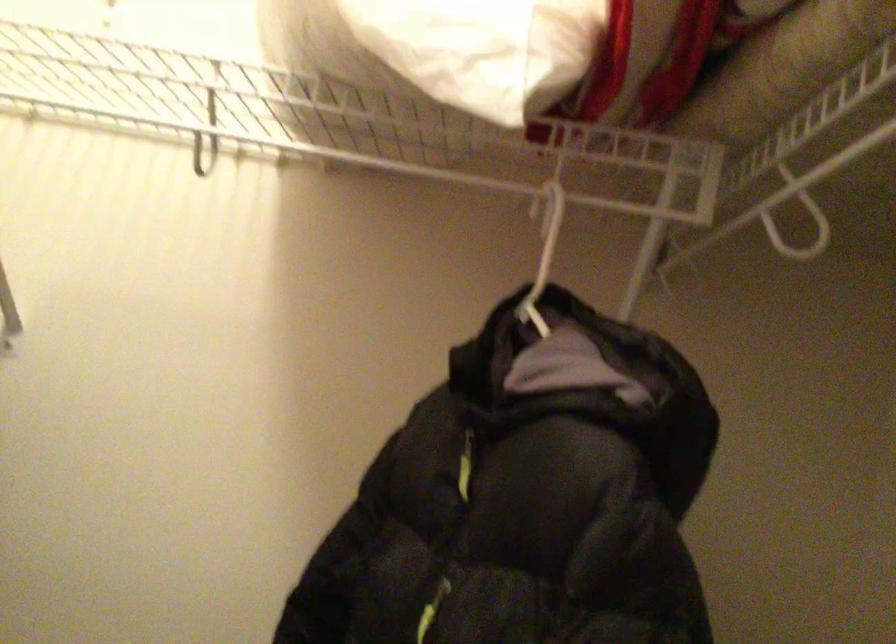
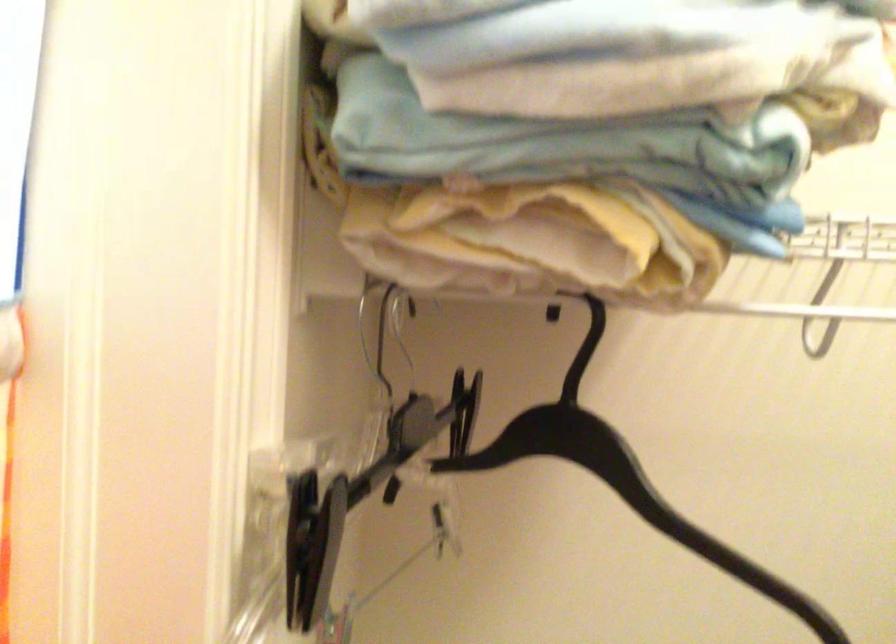
Question: What movement of the cameraman would produce the second image?

Choices:
 (A) Left
 (B) Right
 (C) Forward
 (D) Backward

Answer: (A)